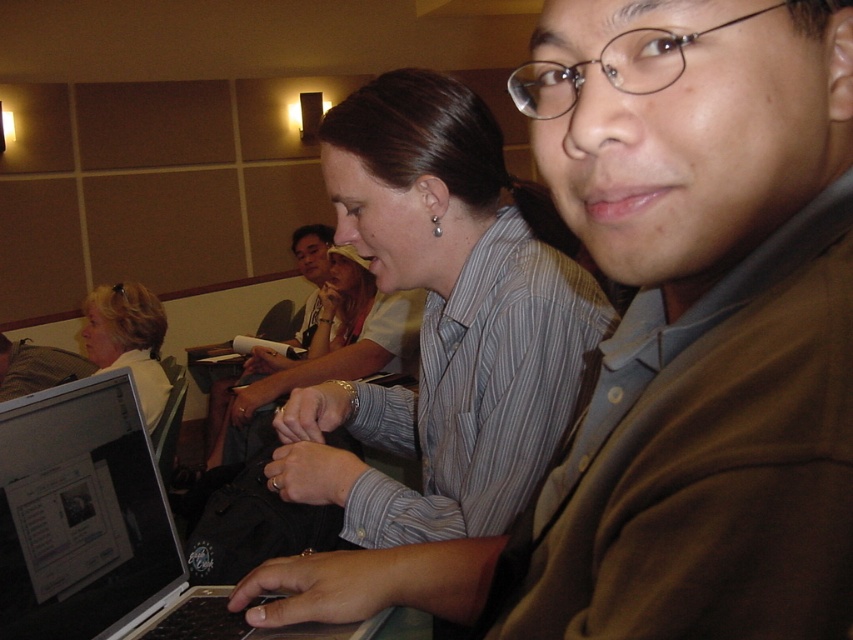
Is point (648, 577) less distant than point (656, 42)?

Yes, it is in front of point (656, 42).

Can you confirm if brown cotton shirt at center is bigger than metallic round glasses at upper right?

Yes, brown cotton shirt at center is bigger than metallic round glasses at upper right.

Who is more distant from viewer, (376, 605) or (527, 90)?

Point (376, 605)

In order to click on brown cotton shirt at center in this screenshot , I will do `click(672, 346)`.

Which is more to the right, striped shirt at center or silver metallic laptop at center?

striped shirt at center

Can you confirm if striped shirt at center is shorter than silver metallic laptop at center?

Incorrect, striped shirt at center's height does not fall short of silver metallic laptop at center's.

The image size is (853, 640). What are the coordinates of `striped shirt at center` in the screenshot? It's located at (445, 321).

I want to click on striped shirt at center, so click(x=445, y=321).

Does brown cotton shirt at center lie behind matte white shirt at center?

That is False.

Locate an element on the screen. The width and height of the screenshot is (853, 640). brown cotton shirt at center is located at coordinates (672, 346).

Is point (662, 525) behind point (216, 436)?

No, (662, 525) is closer to viewer.

Where is `brown cotton shirt at center`? This screenshot has height=640, width=853. brown cotton shirt at center is located at coordinates (672, 346).